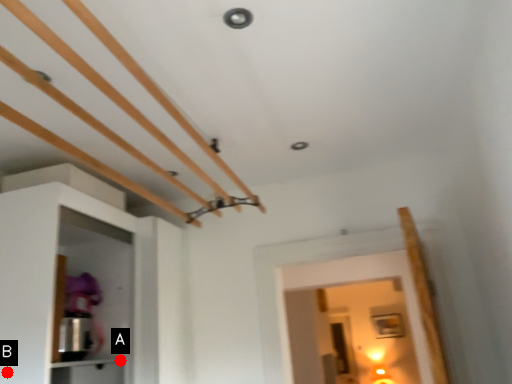
Question: Two points are circled on the image, labeled by A and B beside each circle. Which point is closer to the camera taking this photo?

Choices:
 (A) A is closer
 (B) B is closer

Answer: (B)